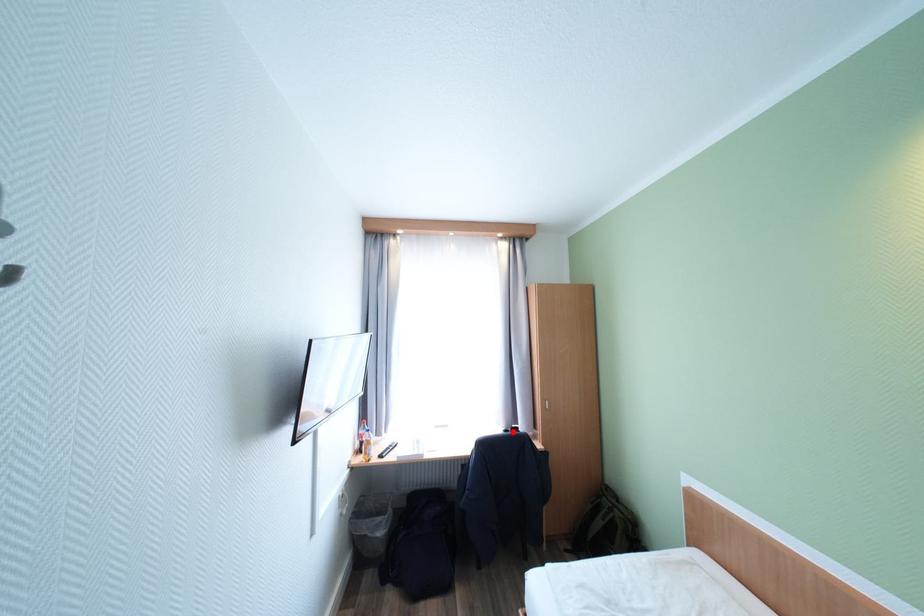
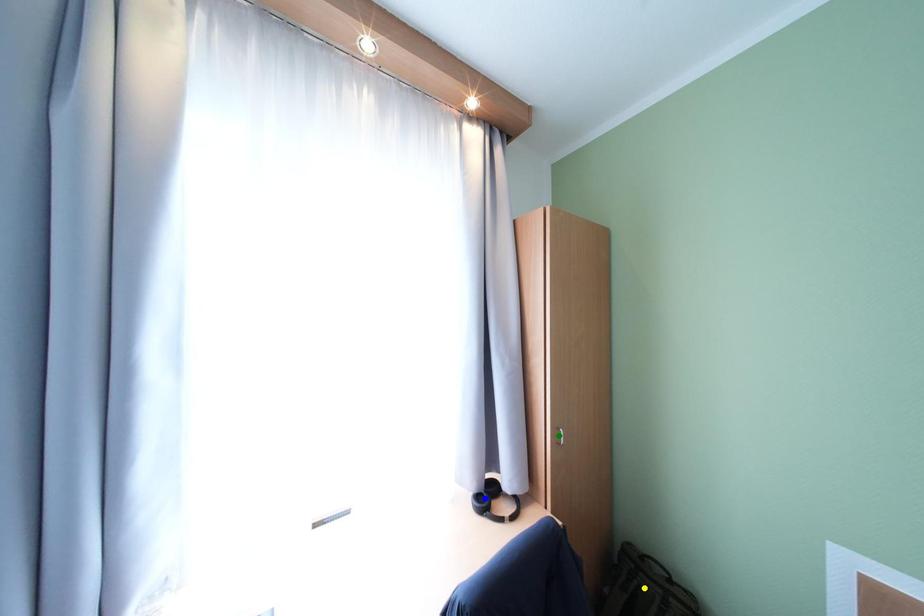
Question: I am providing you with two images of the same scene from different viewpoints. A red point is marked on the first image. You are given multiple points on the second image. In image 2, which mark is for the same physical point as the one in image 1?

Choices:
 (A) green point
 (B) blue point
 (C) yellow point

Answer: (B)